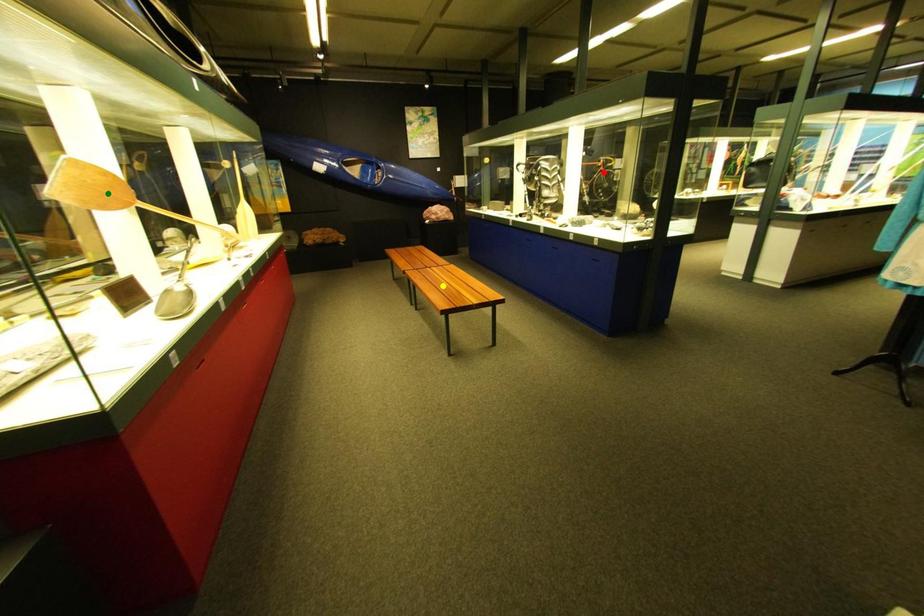
Order these from nearest to farthest:
- green point
- yellow point
- red point

green point
yellow point
red point